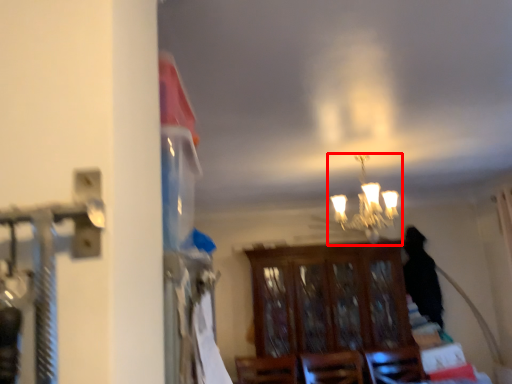
Question: From the image's perspective, where is lamp (annotated by the red box) located in relation to furniture in the image?

Choices:
 (A) above
 (B) below

Answer: (A)